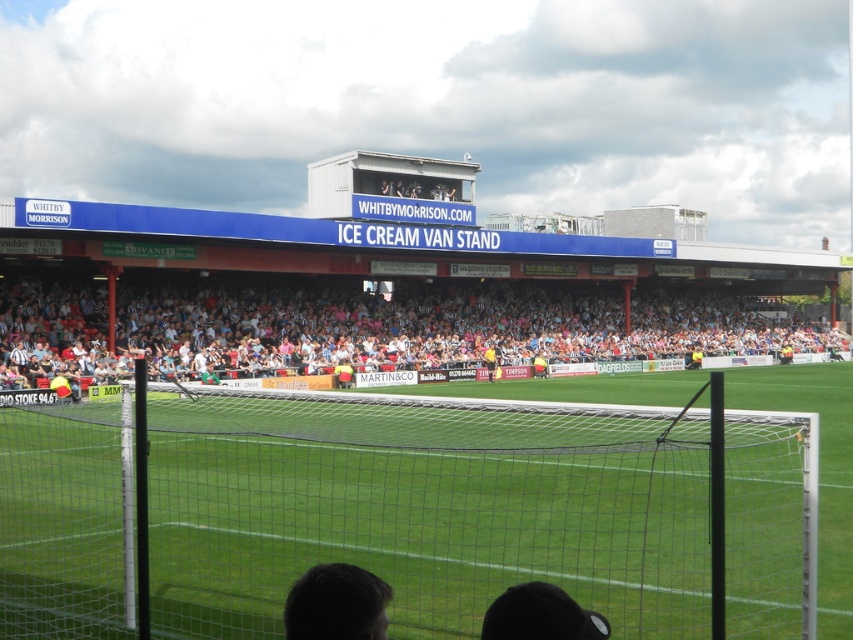
Does point (244, 636) lie in front of point (492, 371)?

Yes, point (244, 636) is closer to viewer.

Between point (778, 413) and point (490, 369), which one is positioned in front?

Point (778, 413) is more forward.

The height and width of the screenshot is (640, 853). In order to click on green netting at center in this screenshot , I will do `click(462, 509)`.

Which of these two, white plastic seats at center or dark brown hair at lower center, stands taller?

With more height is white plastic seats at center.

Is white plastic seats at center shorter than dark brown hair at lower center?

In fact, white plastic seats at center may be taller than dark brown hair at lower center.

Which is behind, point (7, 294) or point (346, 611)?

Point (7, 294)

Image resolution: width=853 pixels, height=640 pixels. I want to click on white plastic seats at center, so click(364, 330).

Between green netting at center and dark brown hair at lower center, which one is positioned higher?

dark brown hair at lower center is above.

Is green netting at center taller than dark brown hair at lower center?

Indeed, green netting at center has a greater height compared to dark brown hair at lower center.

This screenshot has height=640, width=853. Find the location of `green netting at center`. green netting at center is located at coordinates (462, 509).